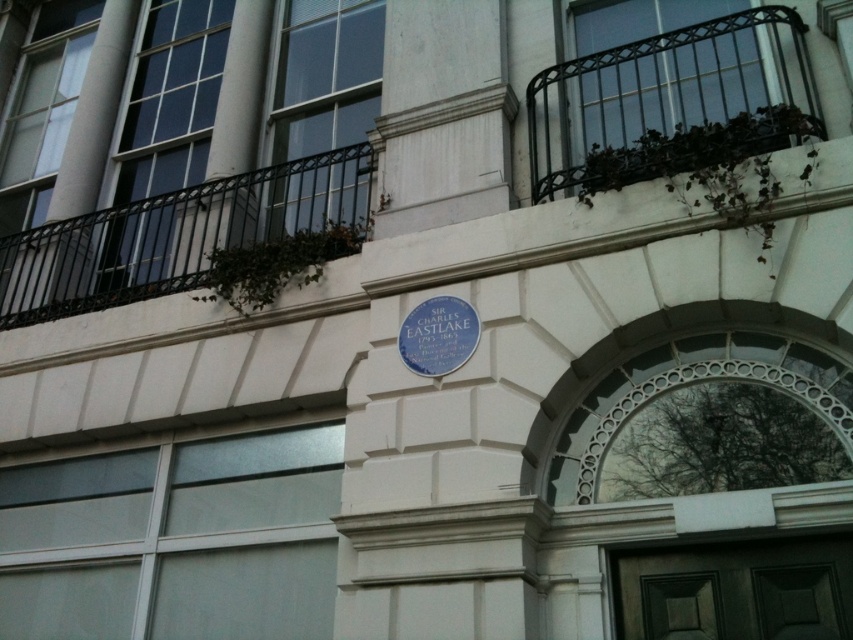
You are standing in front of a classical building and want to take a photo of the blue plaque commemorating Sir Charles Eastlake. The plaque is located near the center of the building. However, there is a black wrought iron balcony at upper left in the way. Considering the distance of the balcony from you, will you need to move closer or farther away to ensure the balcony doesn,t block the plaque in your photo?

The black wrought iron balcony at upper left is 5.73 meters away from the camera. To prevent it from blocking the plaque, you should move farther away so the balcony appears smaller in the frame, allowing the plaque to be visible without obstruction.

You are standing in front of the classical building and want to read the blue plaque at center. However, there is a black wrought iron balcony at upper right above it. Will the balcony block your view of the plaque?

The black wrought iron balcony at upper right is above the blue plaque at center, so it will not block your view of the plaque since it is positioned higher up.

You are standing in front of the classical building and want to read the blue plaque at center. Is the dark wood door at lower center blocking your view of the plaque?

The dark wood door at lower center is closer to the viewer than the blue plaque at center, so the door is blocking your view of the plaque.